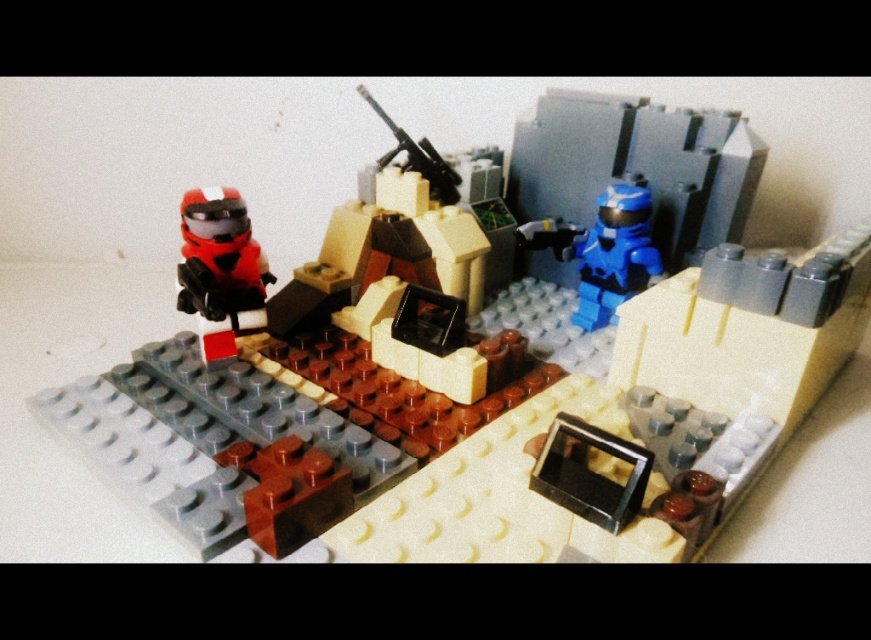
Which is more to the right, matte black helmet at upper left or metallic gun at center?

matte black helmet at upper left is more to the right.

Can you confirm if matte black helmet at upper left is shorter than metallic gun at center?

Incorrect, matte black helmet at upper left's height does not fall short of metallic gun at center's.

What do you see at coordinates (167, 195) in the screenshot? I see `matte black helmet at upper left` at bounding box center [167, 195].

Where is `matte black helmet at upper left`? matte black helmet at upper left is located at coordinates (167, 195).

Is point (248, 266) less distant than point (429, 144)?

That is True.

How distant is matte orange helmet at left from metallic gun at center?

They are 40.00 centimeters apart.

Between point (227, 349) and point (451, 177), which one is positioned in front?

Positioned in front is point (227, 349).

The image size is (871, 640). Identify the location of matte orange helmet at left. (220, 268).

Between matte black helmet at upper left and matte orange helmet at left, which one is positioned higher?

matte black helmet at upper left is above.

Which is in front, point (105, 292) or point (188, 241)?

Point (188, 241) is in front.

Where is `matte black helmet at upper left`? Image resolution: width=871 pixels, height=640 pixels. matte black helmet at upper left is located at coordinates (167, 195).